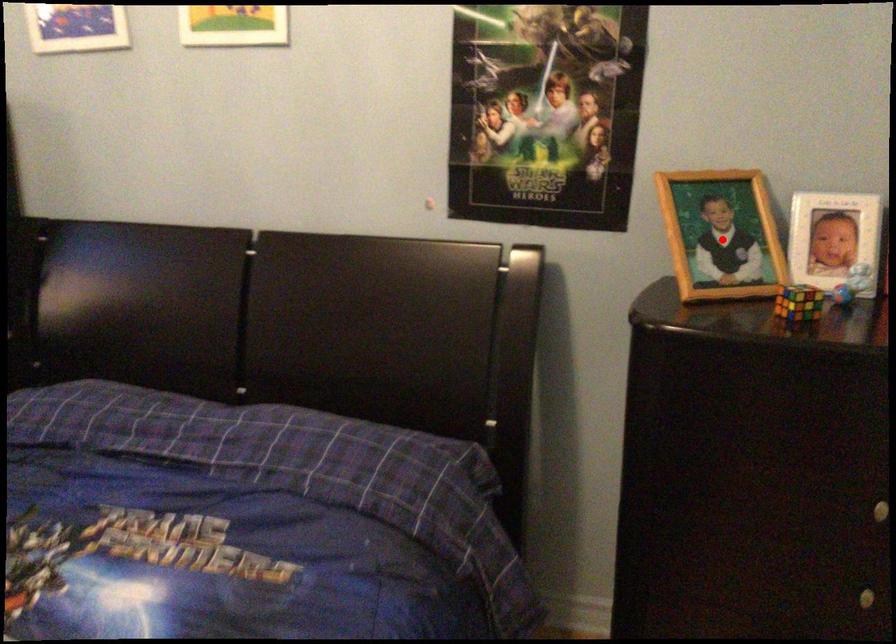
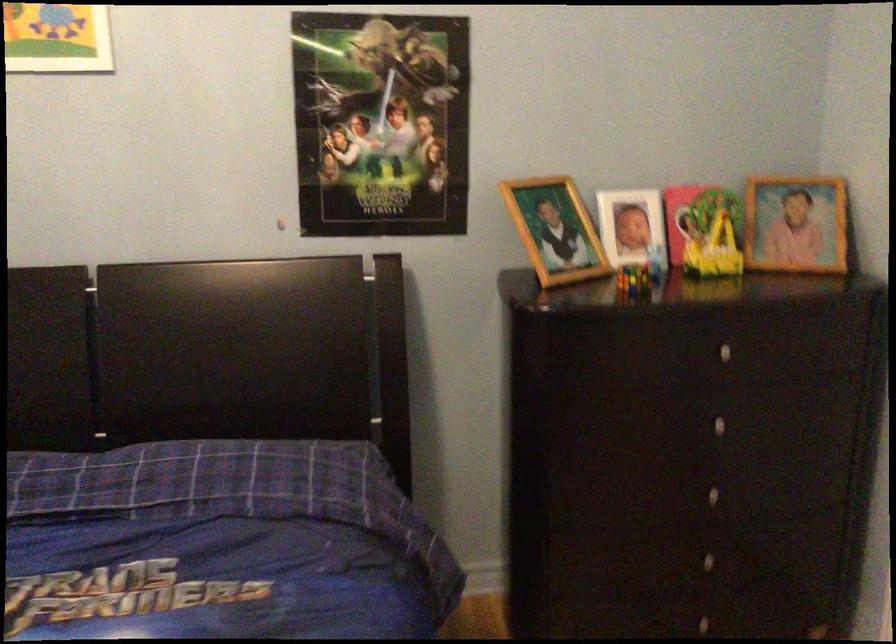
Question: A red point is marked in image1. In image2, is the corresponding 3D point closer to the camera or farther? Reply with the corresponding letter.

Choices:
 (A) The corresponding 3D point is closer.
 (B) The corresponding 3D point is farther.

Answer: (B)